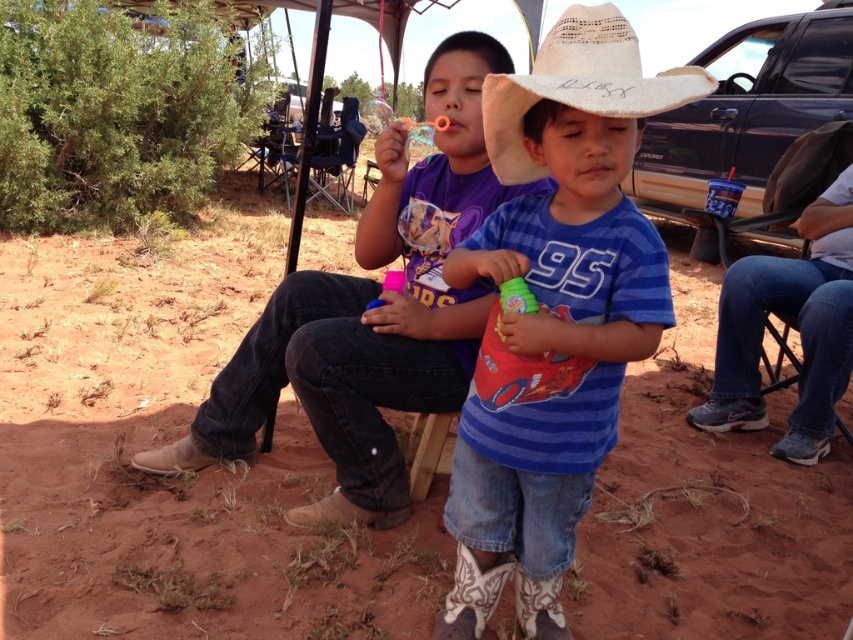
Can you confirm if dirt field at lower center is positioned to the right of straw hat at center?

No, dirt field at lower center is not to the right of straw hat at center.

What do you see at coordinates (173, 477) in the screenshot?
I see `dirt field at lower center` at bounding box center [173, 477].

The image size is (853, 640). Find the location of `dirt field at lower center`. dirt field at lower center is located at coordinates (173, 477).

Can you confirm if blue striped shirt at center is positioned above straw hat at center?

No.

Who is more distant from viewer, [553,316] or [682,67]?

The point [553,316] is more distant.

Which is behind, point (534, 360) or point (502, 92)?

Point (534, 360)

The image size is (853, 640). I want to click on blue striped shirt at center, so click(x=554, y=314).

Does dirt field at lower center appear under denim jeans at center?

Yes.

Between point (223, 484) and point (364, 214), which one is positioned behind?

Positioned behind is point (223, 484).

You are a GUI agent. You are given a task and a screenshot of the screen. Output one action in this format:
    pyautogui.click(x=<x>, y=<y>)
    Task: Click on the dirt field at lower center
    The width and height of the screenshot is (853, 640).
    Given the screenshot: What is the action you would take?
    pyautogui.click(x=173, y=477)